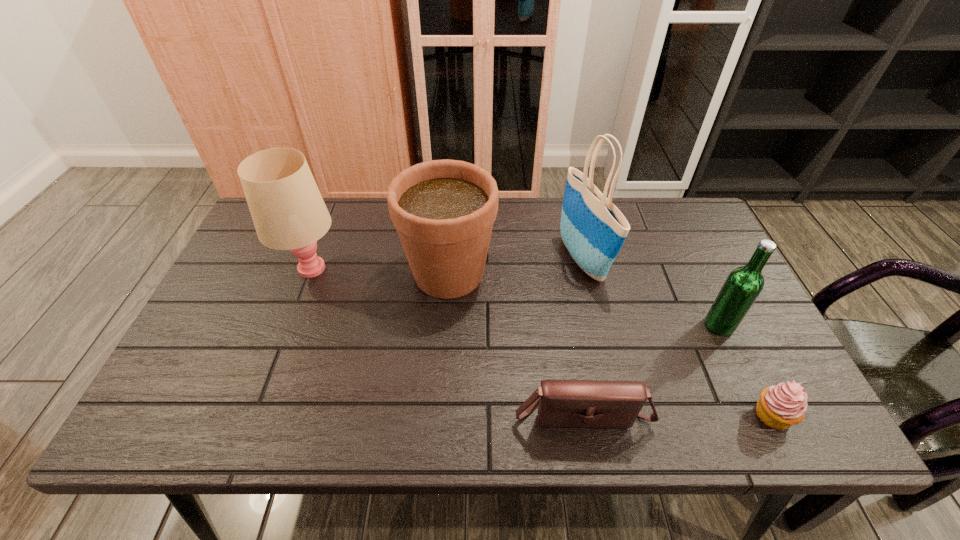
You are a GUI agent. You are given a task and a screenshot of the screen. Output one action in this format:
    pyautogui.click(x=<x>, y=<y>)
    Task: Click on the tote bag
    The height and width of the screenshot is (540, 960).
    Given the screenshot: What is the action you would take?
    pyautogui.click(x=593, y=229)

You are a GUI agent. You are given a task and a screenshot of the screen. Output one action in this format:
    pyautogui.click(x=<x>, y=<y>)
    Task: Click on the leftmost object
    
    Given the screenshot: What is the action you would take?
    pyautogui.click(x=288, y=212)

Find the location of a particular element. This screenshot has width=960, height=540. flowerpot is located at coordinates (443, 210).

Locate an element on the screen. The width and height of the screenshot is (960, 540). beer bottle is located at coordinates (744, 284).

The height and width of the screenshot is (540, 960). What are the coordinates of `the second shortest object` in the screenshot? It's located at (562, 403).

Find the location of a particular element. The image size is (960, 540). the shortest object is located at coordinates (779, 407).

The image size is (960, 540). Identify the location of free space located on the front of the tote bag. (608, 373).

The height and width of the screenshot is (540, 960). I want to click on free point located 0.090m on the back of the leftmost object, so click(x=326, y=227).

Identify the location of vacant space located on the right of the second object from left to right. (557, 273).

Locate an element on the screen. vacant space located on the front of the fourth farthest object is located at coordinates (745, 380).